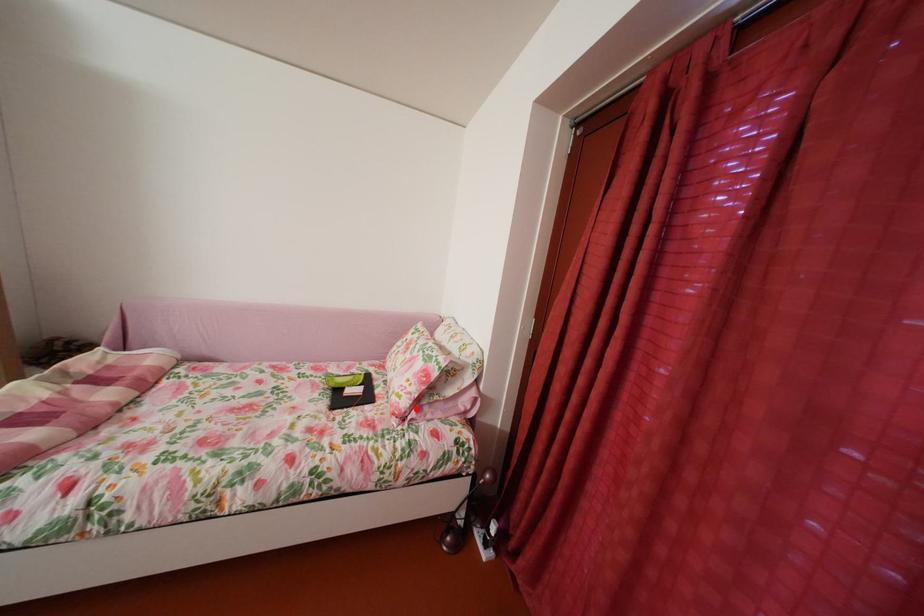
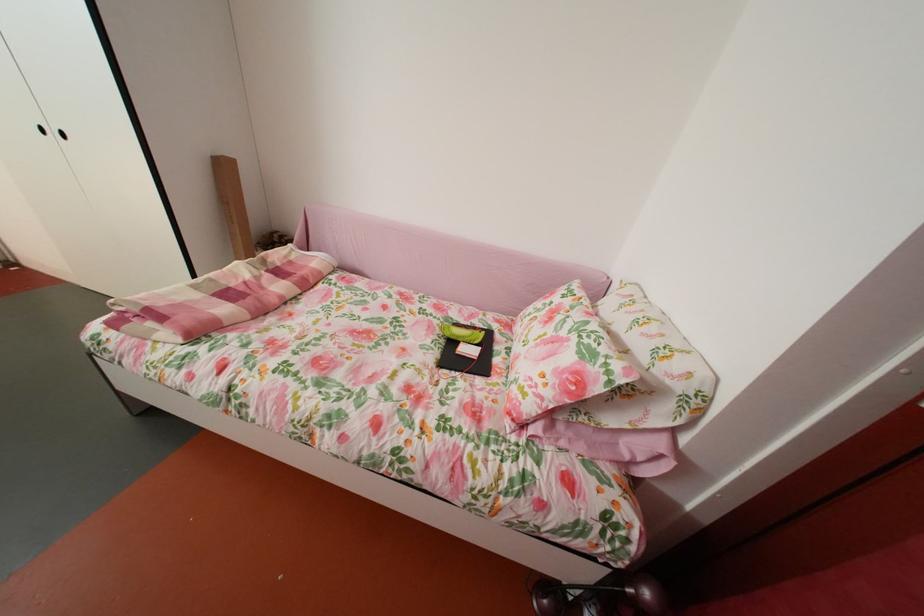
Question: I am providing you with two images of the same scene from different viewpoints. In image1, a red point is highlighted. Considering the same 3D point in image2, which of the following is correct?

Choices:
 (A) It is closer
 (B) It is farther

Answer: (A)